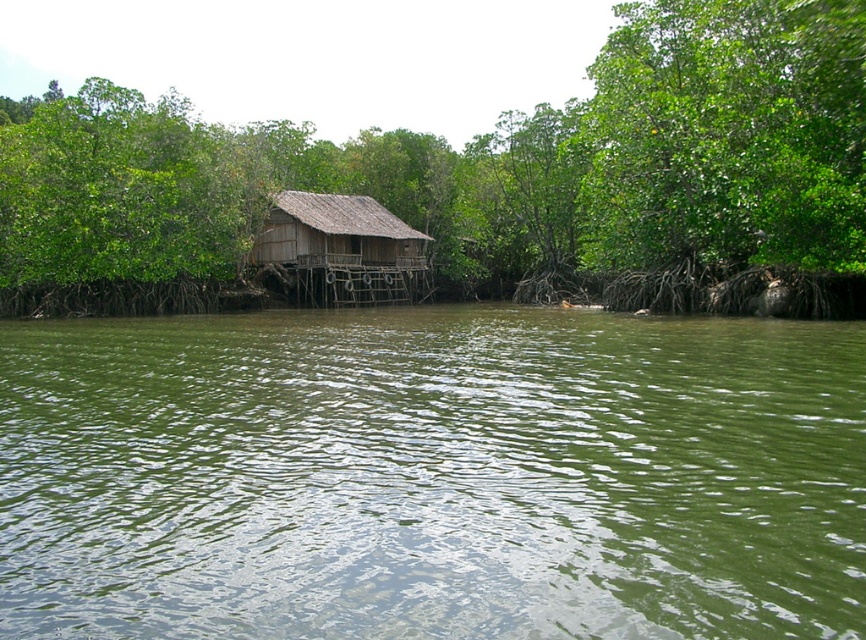
Question: Can you confirm if green water at center is thinner than wooden thatched hut at center?

Choices:
 (A) no
 (B) yes

Answer: (A)

Question: Among these points, which one is farthest from the camera?

Choices:
 (A) (737, 413)
 (B) (320, 202)

Answer: (B)

Question: Considering the real-world distances, which object is closest to the green leafy tree at center?

Choices:
 (A) wooden thatched hut at center
 (B) green water at center

Answer: (A)

Question: Among these objects, which one is nearest to the camera?

Choices:
 (A) wooden thatched hut at center
 (B) green water at center
 (C) green leafy tree at center

Answer: (B)

Question: Does green water at center appear on the left side of green leafy tree at center?

Choices:
 (A) yes
 (B) no

Answer: (B)

Question: Is green leafy tree at center positioned before wooden thatched hut at center?

Choices:
 (A) no
 (B) yes

Answer: (B)